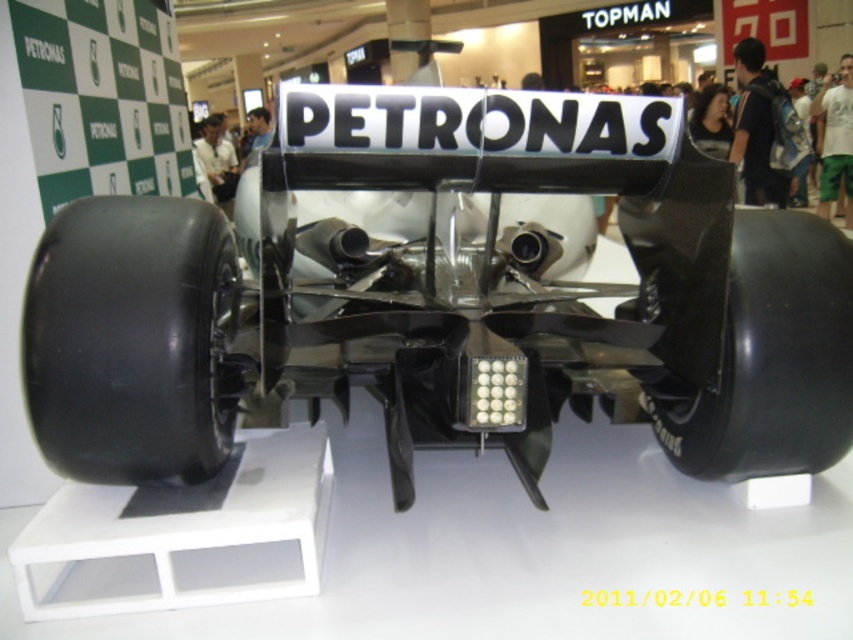
Question: Is carbon fiber race car at center further to the viewer compared to black carbon fiber wheel at center?

Choices:
 (A) yes
 (B) no

Answer: (B)

Question: Can you confirm if carbon fiber race car at center is wider than black carbon fiber wheel at center?

Choices:
 (A) no
 (B) yes

Answer: (B)

Question: Does carbon fiber race car at center appear under black rubber wheel at lower left?

Choices:
 (A) yes
 (B) no

Answer: (B)

Question: Which object is the farthest from the black rubber wheel at lower left?

Choices:
 (A) carbon fiber race car at center
 (B) black carbon fiber wheel at center

Answer: (B)

Question: Which point is closer to the camera?

Choices:
 (A) (807, 285)
 (B) (692, 461)

Answer: (A)

Question: Among these points, which one is nearest to the camera?

Choices:
 (A) (187, 321)
 (B) (799, 221)
 (C) (146, 461)

Answer: (A)